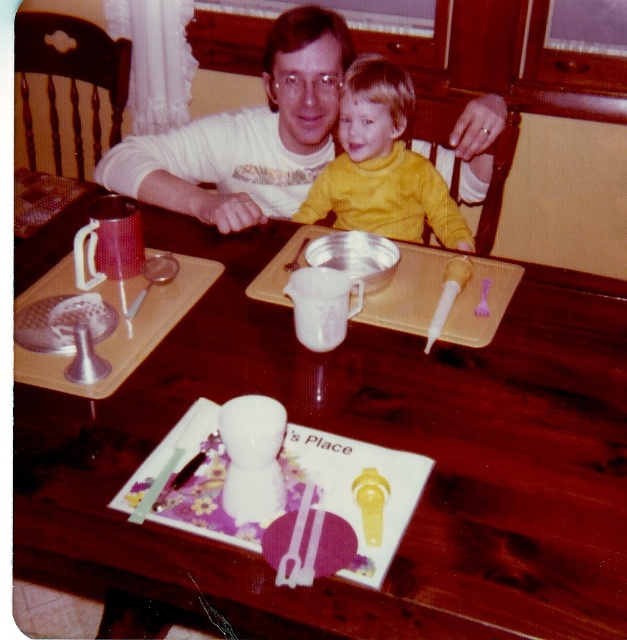
You are a person who is 6 feet tall and standing in front of the wooden table at center. If you want to reach the items on the table, will you be able to comfortably do so without bending down too much?

The wooden table at center is 26.94 inches away from the viewer. Since the average dining table height is around 30 inches, and the viewer is 6 feet tall, they would need to bend slightly to reach the items on the table.

You are a photographer trying to capture the scene of the white matte shirt at upper center and the yellow matte shirt at center. Which shirt is covering part of the other?

The white matte shirt at upper center is positioned over the yellow matte shirt at center, so it is covering part of it.